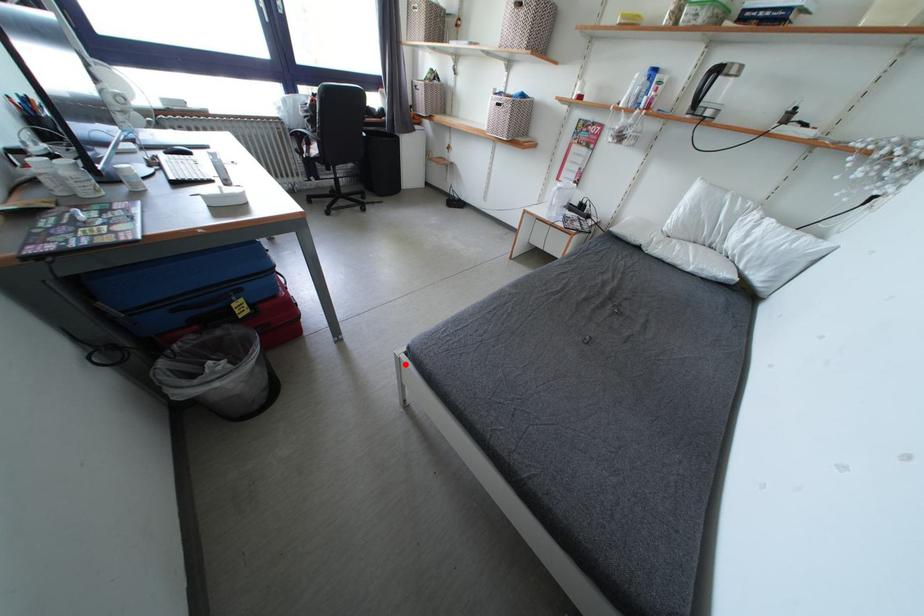
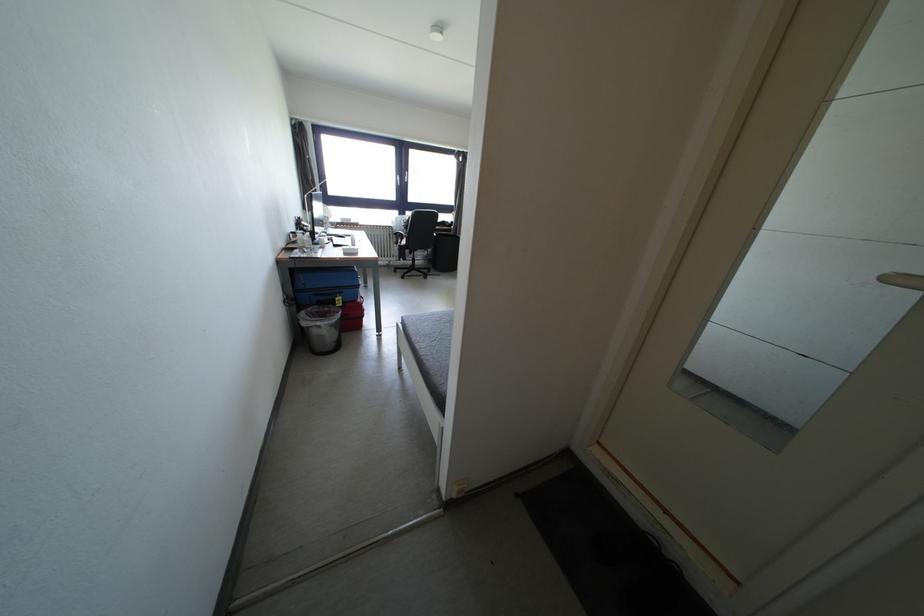
Where in the second image is the point corresponding to the highlighted location from the first image?

(403, 330)